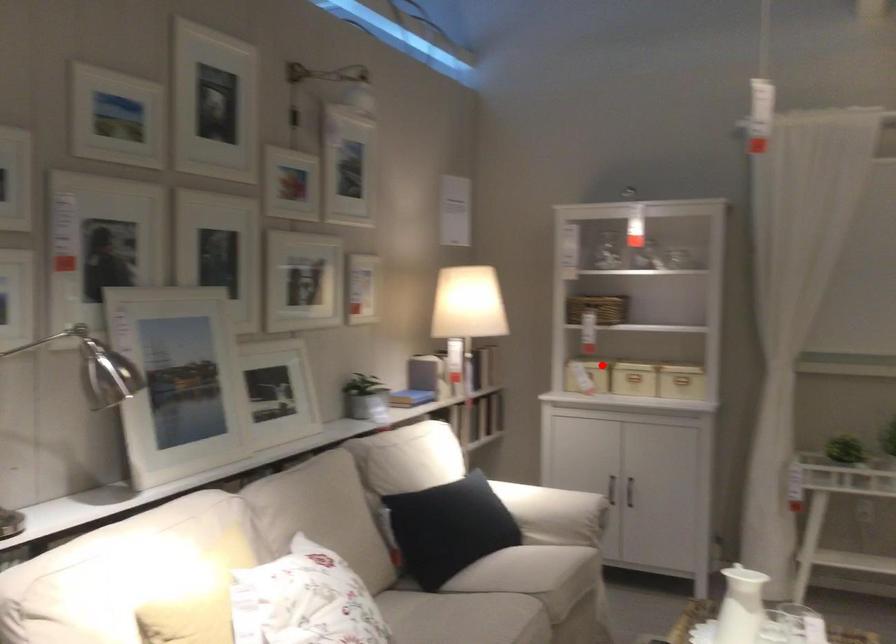
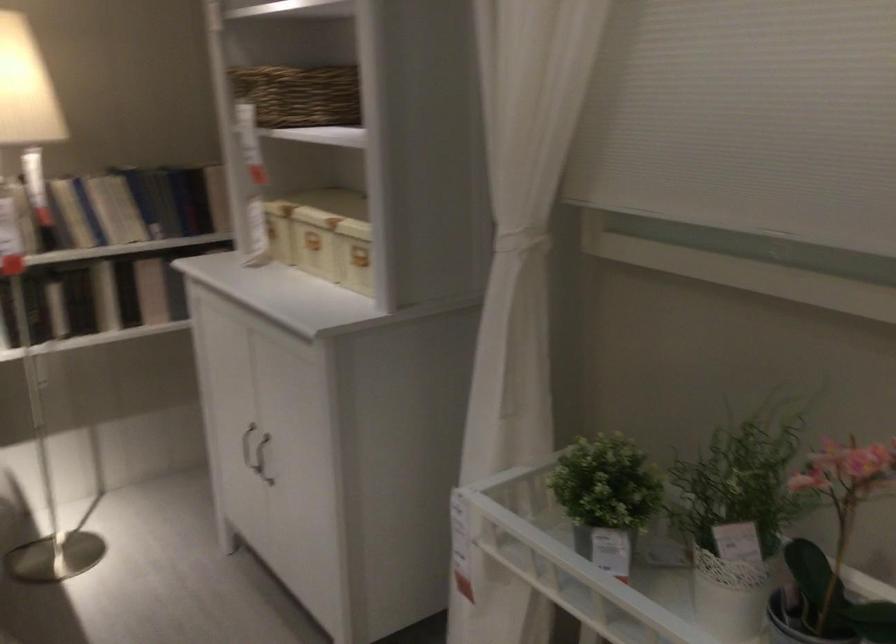
Question: I am providing you with two images of the same scene from different viewpoints. In image1, a red point is highlighted. Considering the same 3D point in image2, which of the following is correct?

Choices:
 (A) It is closer
 (B) It is farther

Answer: (A)